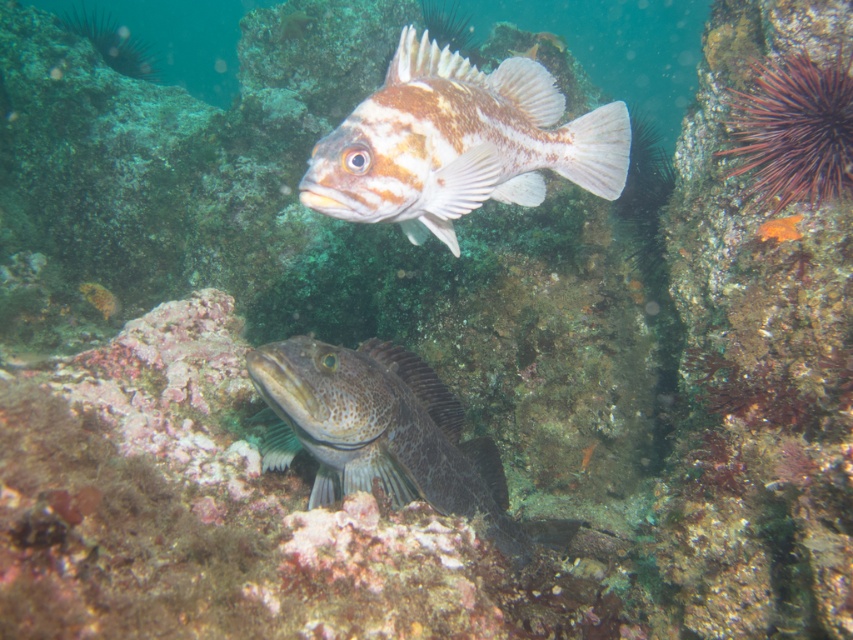
Question: Is speckled brown fish at upper center wider than speckled dark gray fish at lower center?

Choices:
 (A) no
 (B) yes

Answer: (A)

Question: Does speckled brown fish at upper center appear on the right side of speckled dark gray fish at lower center?

Choices:
 (A) no
 (B) yes

Answer: (B)

Question: Among these objects, which one is nearest to the camera?

Choices:
 (A) speckled brown fish at upper center
 (B) speckled dark gray fish at lower center

Answer: (A)

Question: Is speckled brown fish at upper center above speckled dark gray fish at lower center?

Choices:
 (A) no
 (B) yes

Answer: (B)

Question: Which object is closer to the camera taking this photo?

Choices:
 (A) speckled dark gray fish at lower center
 (B) speckled brown fish at upper center

Answer: (B)